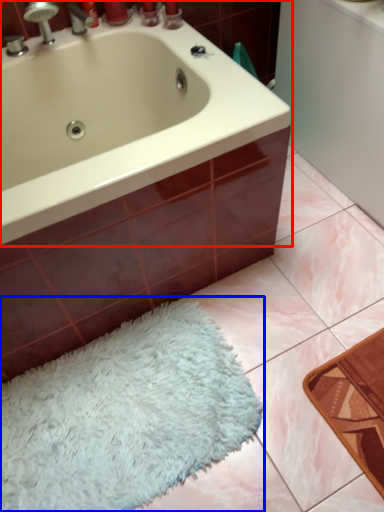
Question: Which of the following is the closest to the observer, bathtub (highlighted by a red box) or bath mat (highlighted by a blue box)?

Choices:
 (A) bathtub
 (B) bath mat

Answer: (A)